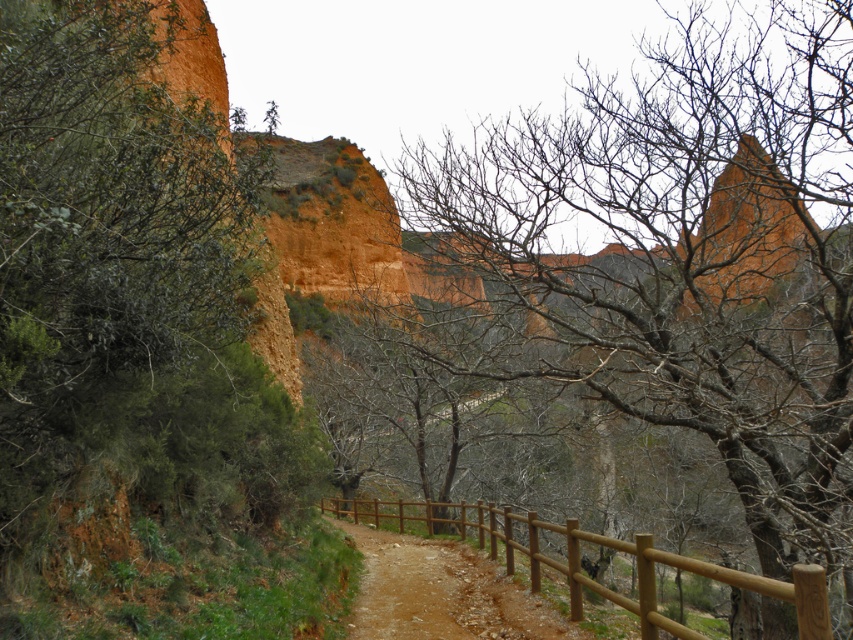
You are a hiker trying to navigate a narrow path. You see the bare branches at center and the brown wooden fence at lower center. Which object is closer to your right side as you face the direction of the path?

The bare branches at center is to the right of brown wooden fence at lower center, so it is closer to your right side as you face the path direction.

You are a hiker standing at the point marked by the coordinates point [682,253]. Looking around, you see the rugged, reddish brown cliff face on the left and the leafless branches of trees on the right. What do you see directly in front of you?

At point [682,253] lies bare branches at center, so directly in front of you are the bare branches at center.

In the scene shown: You are a hiker standing at the cliff edge and want to take a photo of both the point at coordinates point (724, 163) and point (653, 621). Which point is closer to your camera lens?

Point (724, 163) is further to the camera than point (653, 621), so the point (653, 621) is closer to the camera lens.